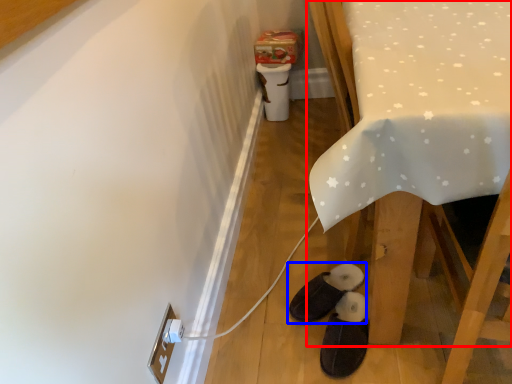
Question: Which point is closer to the camera, furniture (highlighted by a red box) or footwear (highlighted by a blue box)?

Choices:
 (A) furniture
 (B) footwear

Answer: (A)